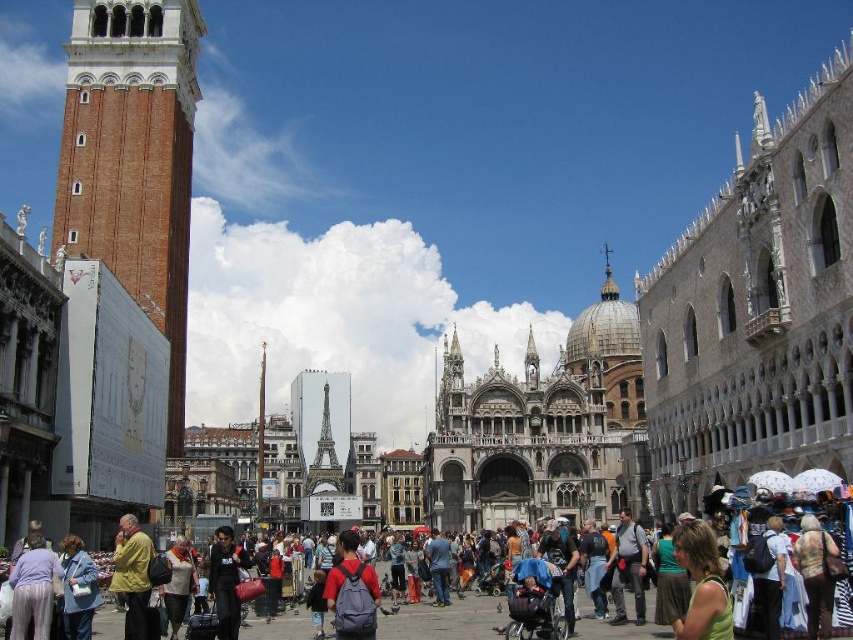
Question: Among these points, which one is farthest from the camera?

Choices:
 (A) (57, 193)
 (B) (567, 387)

Answer: (B)

Question: Among these objects, which one is nearest to the camera?

Choices:
 (A) matte black backpacks at center
 (B) black leather jacket at center
 (C) green fabric shirt at lower right
 (D) brown leather backpack at lower right

Answer: (C)

Question: Is denim jacket at lower left thinner than black leather jacket at center?

Choices:
 (A) no
 (B) yes

Answer: (A)

Question: Considering the relative positions of black leather jacket at center and matte gray backpack at center in the image provided, where is black leather jacket at center located with respect to matte gray backpack at center?

Choices:
 (A) above
 (B) below

Answer: (B)

Question: Is brick tower at left further to camera compared to denim jacket at lower left?

Choices:
 (A) no
 (B) yes

Answer: (B)

Question: Which of the following is the farthest from the observer?

Choices:
 (A) denim jacket at lower left
 (B) brown leather backpack at lower right
 (C) matte black backpacks at center
 (D) light brown leather jacket at lower left

Answer: (D)